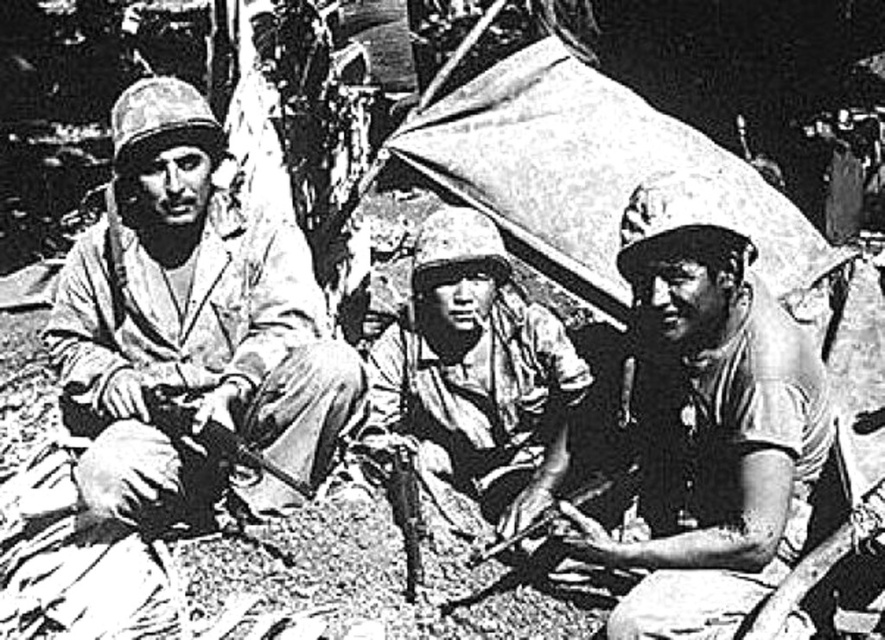
Locate an element on the screen. matte khaki helmet at center is located at coordinates (718, 417).

Which is more to the left, matte khaki helmet at center or camouflage fabric helmet at center?

camouflage fabric helmet at center

What do you see at coordinates (718, 417) in the screenshot? Image resolution: width=885 pixels, height=640 pixels. I see `matte khaki helmet at center` at bounding box center [718, 417].

Identify the location of matte khaki helmet at center. (718, 417).

Does matte khaki uniform at left have a lesser height compared to camouflage fabric helmet at center?

No.

Which is in front, point (286, 316) or point (451, 296)?

Point (286, 316) is in front.

Where is `matte khaki uniform at left`? The width and height of the screenshot is (885, 640). matte khaki uniform at left is located at coordinates (189, 320).

Looking at this image, which is more to the left, matte khaki uniform at left or matte khaki helmet at center?

matte khaki uniform at left

Consider the image. Who is lower down, matte khaki uniform at left or matte khaki helmet at center?

Positioned lower is matte khaki helmet at center.

Which is in front, point (348, 355) or point (756, 480)?

Point (756, 480)

Where is `matte khaki uniform at left`? matte khaki uniform at left is located at coordinates (189, 320).